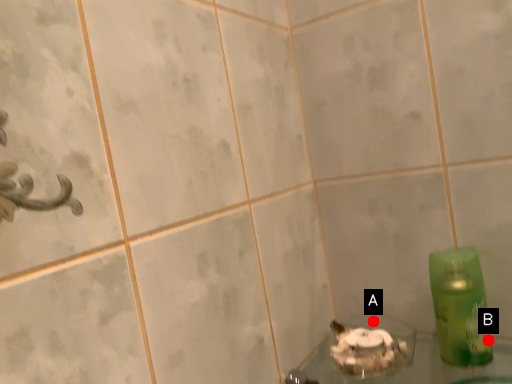
Question: Two points are circled on the image, labeled by A and B beside each circle. Which point appears farthest from the camera in this image?

Choices:
 (A) A is further
 (B) B is further

Answer: (A)